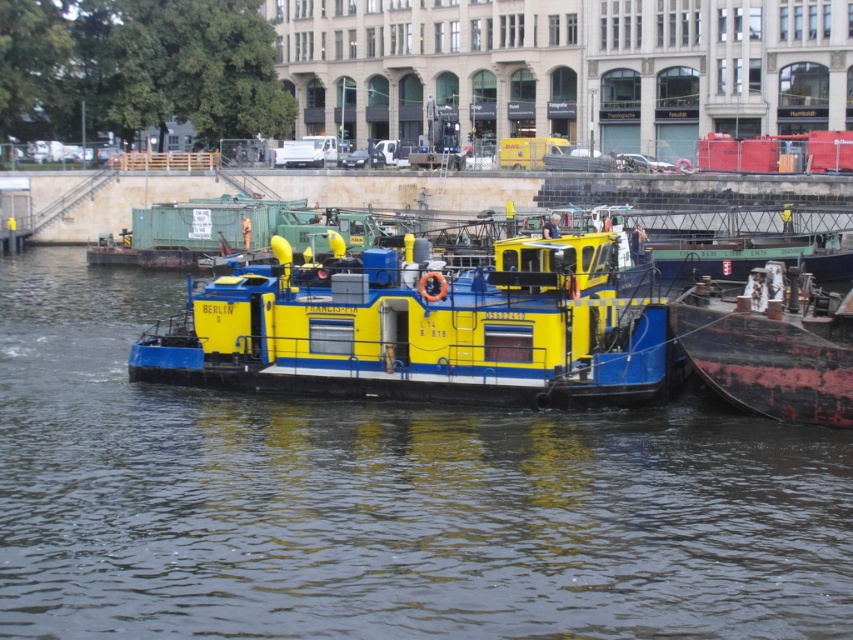
Question: Which point appears closest to the camera in this image?

Choices:
 (A) (364, 564)
 (B) (236, 337)
 (C) (799, 404)

Answer: (A)

Question: Estimate the real-world distances between objects in this image. Which object is farther from the yellow matte barge at center?

Choices:
 (A) rusty metal barge at right
 (B) blue/yellow barge at center

Answer: (A)

Question: Is blue/yellow barge at center further to camera compared to rusty metal barge at right?

Choices:
 (A) yes
 (B) no

Answer: (B)

Question: Which point is farther from the camera taking this photo?

Choices:
 (A) (187, 589)
 (B) (741, 323)

Answer: (B)

Question: Is yellow matte barge at center positioned behind rusty metal barge at right?

Choices:
 (A) yes
 (B) no

Answer: (B)

Question: Can you confirm if blue/yellow barge at center is positioned above yellow matte barge at center?

Choices:
 (A) no
 (B) yes

Answer: (A)